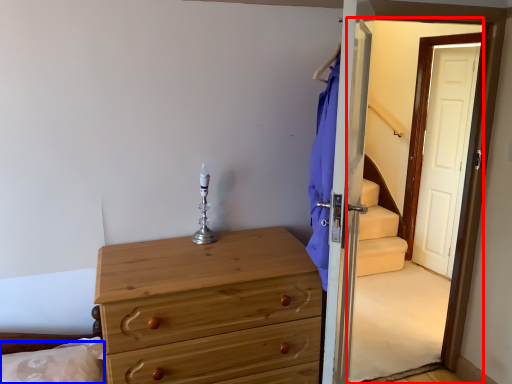
Question: Which point is closer to the camera, screen door (highlighted by a red box) or pillow (highlighted by a blue box)?

Choices:
 (A) screen door
 (B) pillow

Answer: (A)